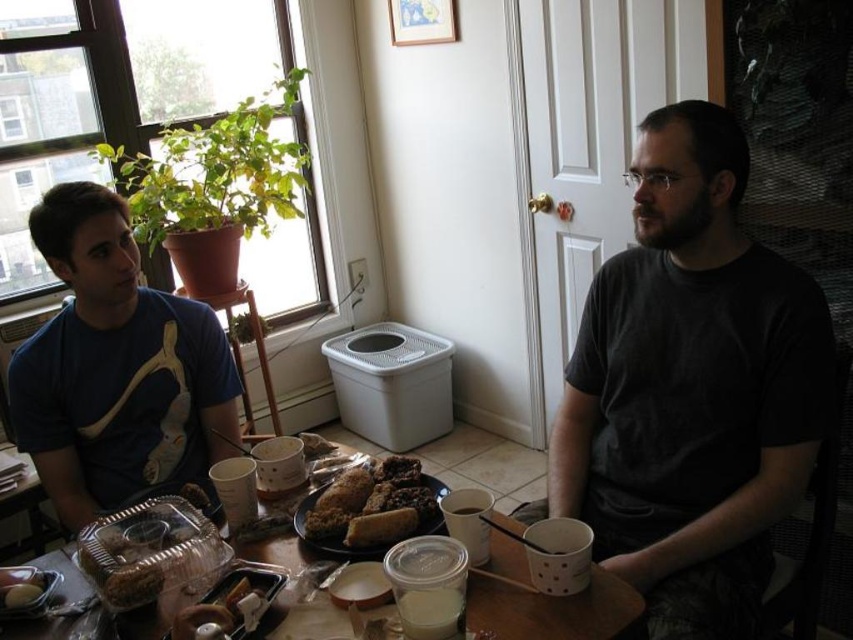
Question: Is the position of chocolate cake at center less distant than that of slightly toasted bread at center?

Choices:
 (A) yes
 (B) no

Answer: (B)

Question: Estimate the real-world distances between objects in this image. Which object is farther from the dark gray t-shirt at center?

Choices:
 (A) chocolate cake at center
 (B) slightly toasted bread at center
 (C) clear plastic table at center

Answer: (C)

Question: Among these objects, which one is farthest from the camera?

Choices:
 (A) slightly toasted bread at center
 (B) clear plastic table at center
 (C) matte blue t-shirt at left
 (D) dark gray t-shirt at center

Answer: (B)

Question: Among these objects, which one is nearest to the camera?

Choices:
 (A) clear plastic table at center
 (B) slightly toasted bread at center
 (C) chocolate cake at center
 (D) dark gray t-shirt at center

Answer: (B)

Question: Is clear plastic table at center smaller than slightly toasted bread at center?

Choices:
 (A) no
 (B) yes

Answer: (A)

Question: Is dark gray t-shirt at center wider than slightly toasted bread at center?

Choices:
 (A) no
 (B) yes

Answer: (B)